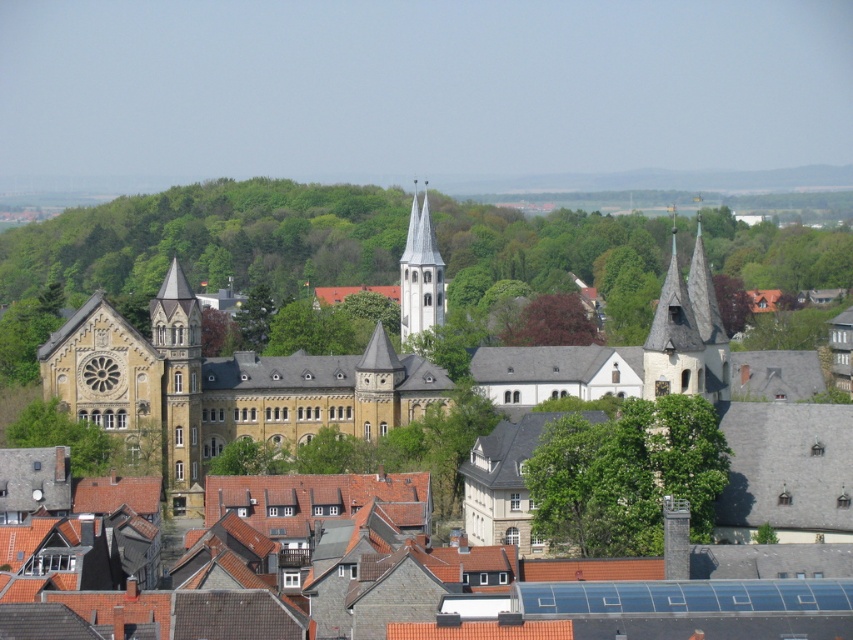
Who is taller, golden stone church at center or green leafy tree at center?

golden stone church at center is taller.

Which is behind, point (299, 408) or point (611, 522)?

The point (299, 408) is behind.

Locate an element on the screen. The height and width of the screenshot is (640, 853). golden stone church at center is located at coordinates (219, 385).

Can you confirm if golden stone church at center is wider than white stone spire at center?

Yes.

Who is more distant from viewer, (149, 433) or (416, 310)?

The point (416, 310) is more distant.

The height and width of the screenshot is (640, 853). Describe the element at coordinates (219, 385) in the screenshot. I see `golden stone church at center` at that location.

Where is `golden stone church at center`? The width and height of the screenshot is (853, 640). golden stone church at center is located at coordinates (219, 385).

Is point (138, 346) positioned in front of point (172, 428)?

Yes, it is.

Who is more forward, (378, 387) or (231, 422)?

Point (378, 387) is more forward.

Where is `yellow stone building at center`? The image size is (853, 640). yellow stone building at center is located at coordinates (218, 387).